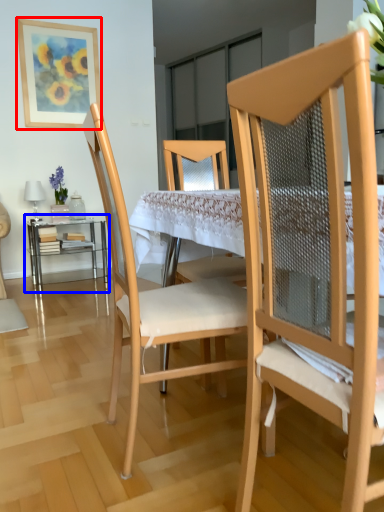
Question: Which object appears closest to the camera in this image, picture frame (highlighted by a red box) or table (highlighted by a blue box)?

Choices:
 (A) picture frame
 (B) table

Answer: (B)